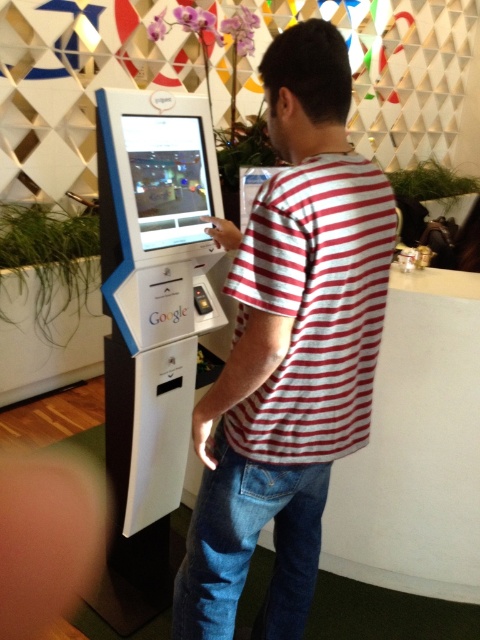
Question: Which point is farther to the camera?

Choices:
 (A) white striped shirt at center
 (B) red striped t-shirt at center

Answer: (A)

Question: Does white striped shirt at center appear over red striped t-shirt at center?

Choices:
 (A) no
 (B) yes

Answer: (A)

Question: Is white striped shirt at center bigger than red striped t-shirt at center?

Choices:
 (A) yes
 (B) no

Answer: (A)

Question: Which point appears farthest from the camera in this image?

Choices:
 (A) (298, 349)
 (B) (313, 552)

Answer: (B)

Question: From the image, what is the correct spatial relationship of white striped shirt at center in relation to red striped t-shirt at center?

Choices:
 (A) above
 (B) below

Answer: (B)

Question: Among these points, which one is farthest from the camera?

Choices:
 (A) (211, 492)
 (B) (372, 268)

Answer: (A)